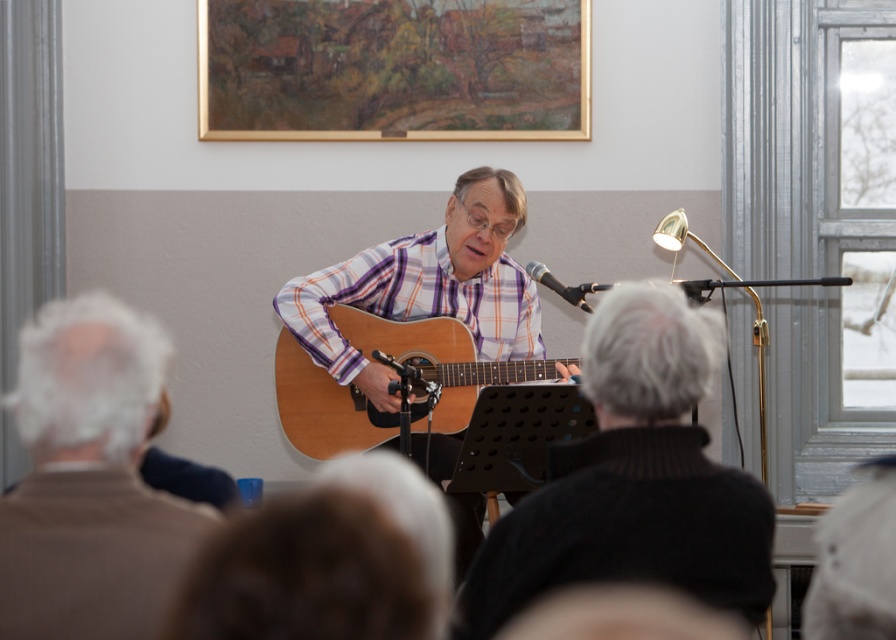
You are a photographer trying to capture a clear shot of the purple striped shirt at center and the metallic silver microphone at center. Which object is closer to the camera lens?

The purple striped shirt at center is closer to the camera lens than the metallic silver microphone at center because it is further to the viewer than the microphone.